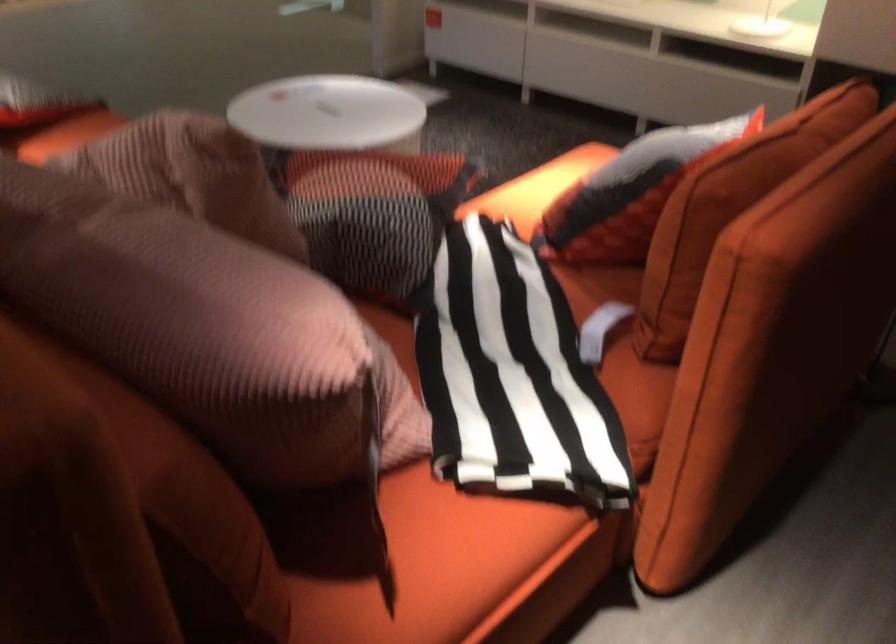
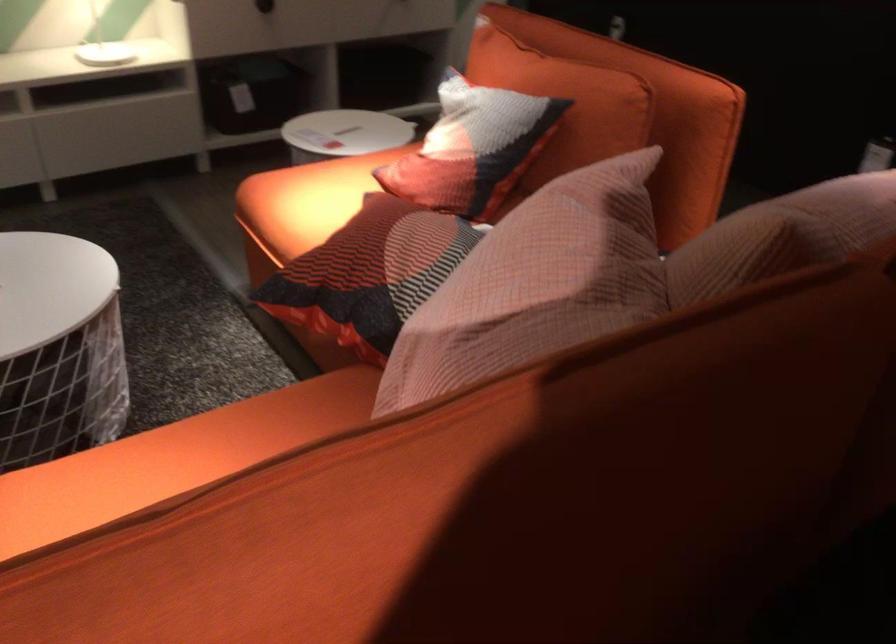
Question: I am providing you with two images of the same scene from different viewpoints. After the viewpoint changes to image2, which objects are now occluded?

Choices:
 (A) black patterned pillow
 (B) patterned throw pillow
 (C) black drawer knob
 (D) white electronics box

Answer: (A)